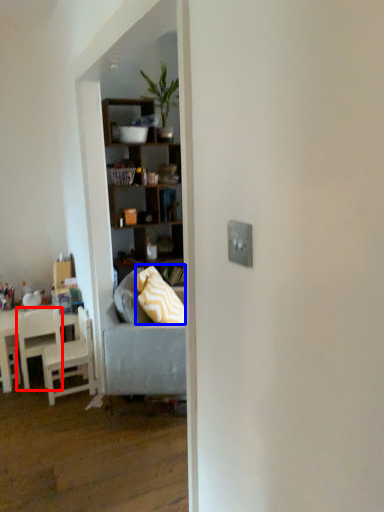
Question: Which object is further to the camera taking this photo, chair (highlighted by a red box) or pillow (highlighted by a blue box)?

Choices:
 (A) chair
 (B) pillow

Answer: (A)